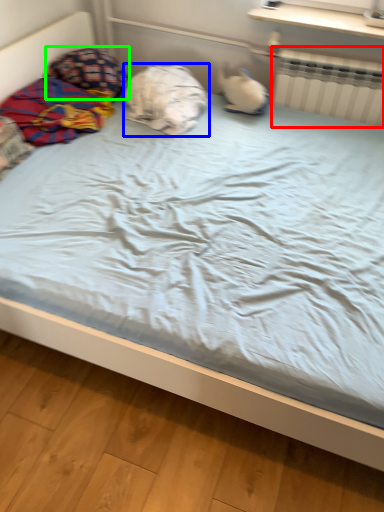
Question: Which is nearer to the radiator (highlighted by a red box)? pillow (highlighted by a blue box) or pillow (highlighted by a green box).

Choices:
 (A) pillow
 (B) pillow

Answer: (A)